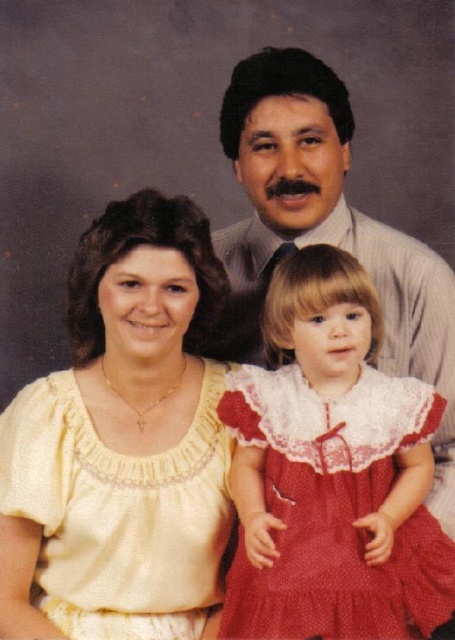
Question: From the image, what is the correct spatial relationship of yellow satin blouse at center in relation to red lace dress at center?

Choices:
 (A) left
 (B) right

Answer: (A)

Question: Observing the image, what is the correct spatial positioning of yellow satin blouse at center in reference to red lace dress at center?

Choices:
 (A) right
 (B) left

Answer: (B)

Question: Which object is farther from the camera taking this photo?

Choices:
 (A) yellow satin blouse at center
 (B) red lace dress at center

Answer: (A)

Question: Among these objects, which one is nearest to the camera?

Choices:
 (A) red lace dress at center
 (B) yellow satin blouse at center

Answer: (A)

Question: In this image, where is yellow satin blouse at center located relative to red lace dress at center?

Choices:
 (A) above
 (B) below

Answer: (A)

Question: Among these objects, which one is farthest from the camera?

Choices:
 (A) red lace dress at center
 (B) yellow satin blouse at center

Answer: (B)